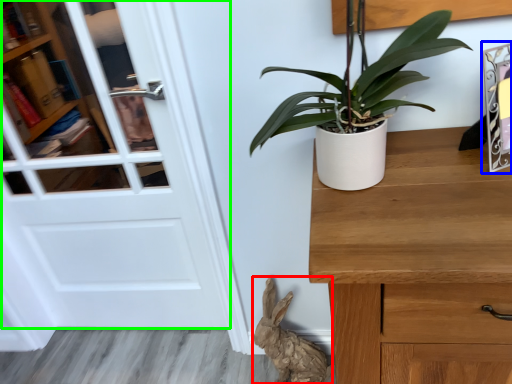
Question: Which object is positioned farthest from animal (highlighted by a red box)? Select from picture frame (highlighted by a blue box) and door (highlighted by a green box).

Choices:
 (A) picture frame
 (B) door

Answer: (A)